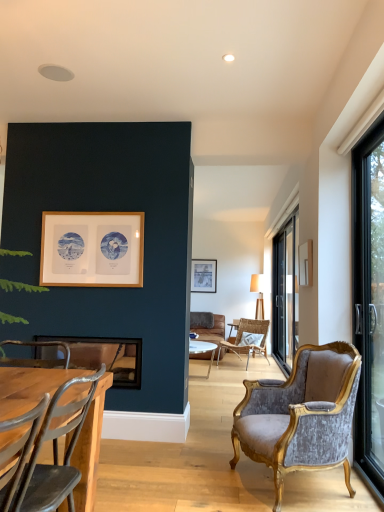
Image resolution: width=384 pixels, height=512 pixels. What are the coordinates of `empty space that is ontop of wooden frame at upper left, the 1th picture frame in the top-to-bottom sequence (from a real-world perspective)` in the screenshot? It's located at (91, 211).